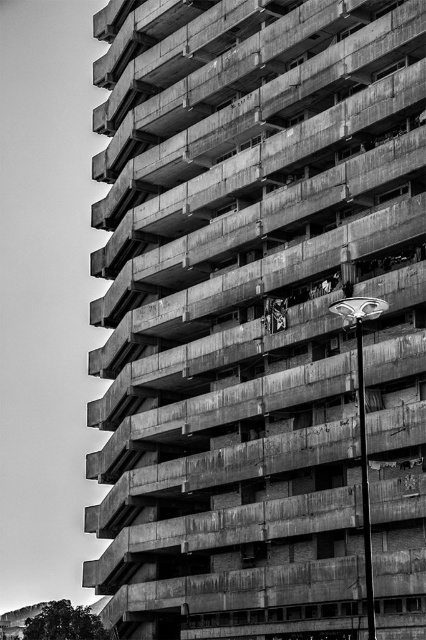
You are standing in front of the building and notice two points marked on the facade. The first point is at coordinates point (348, 316) and the second is at point (267, 312). Which point is closer to you?

Point (348, 316) is in front of point (267, 312), so the first point is closer to you.